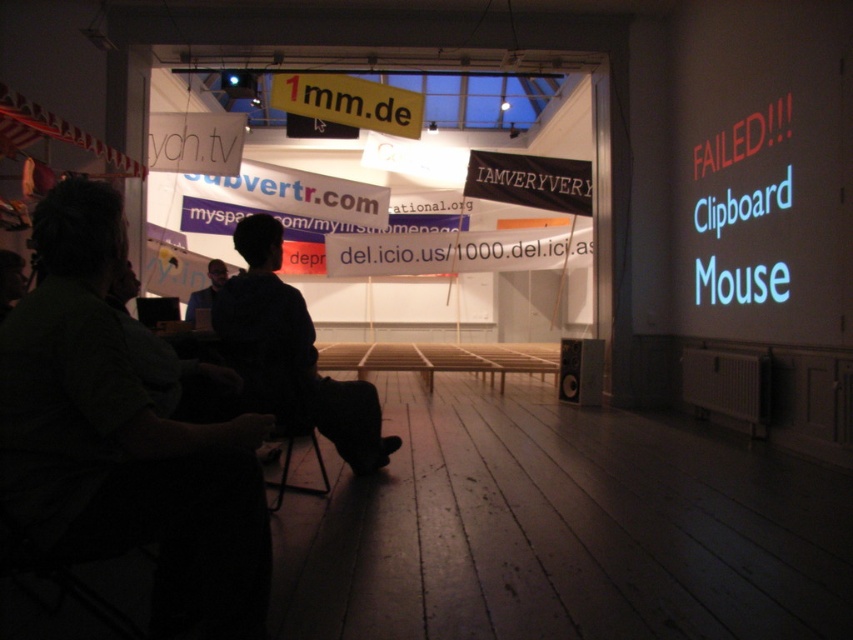
Question: Which object appears farthest from the camera in this image?

Choices:
 (A) dark green shirt at left
 (B) dark blue shirt at center
 (C) black fabric chair at lower center
 (D) dark green shirt at center

Answer: (D)

Question: Which object is positioned farthest from the black fabric chair at lower center?

Choices:
 (A) dark green shirt at center
 (B) dark blue shirt at center
 (C) dark green shirt at left

Answer: (A)

Question: Is dark green shirt at left thinner than dark green shirt at center?

Choices:
 (A) no
 (B) yes

Answer: (B)

Question: In this image, where is dark blue shirt at center located relative to black fabric chair at lower center?

Choices:
 (A) right
 (B) left

Answer: (A)

Question: Which point is closer to the camera taking this photo?

Choices:
 (A) (166, 563)
 (B) (282, 412)
 (C) (207, 307)

Answer: (A)

Question: Is dark green shirt at left above black fabric chair at lower center?

Choices:
 (A) no
 (B) yes

Answer: (B)